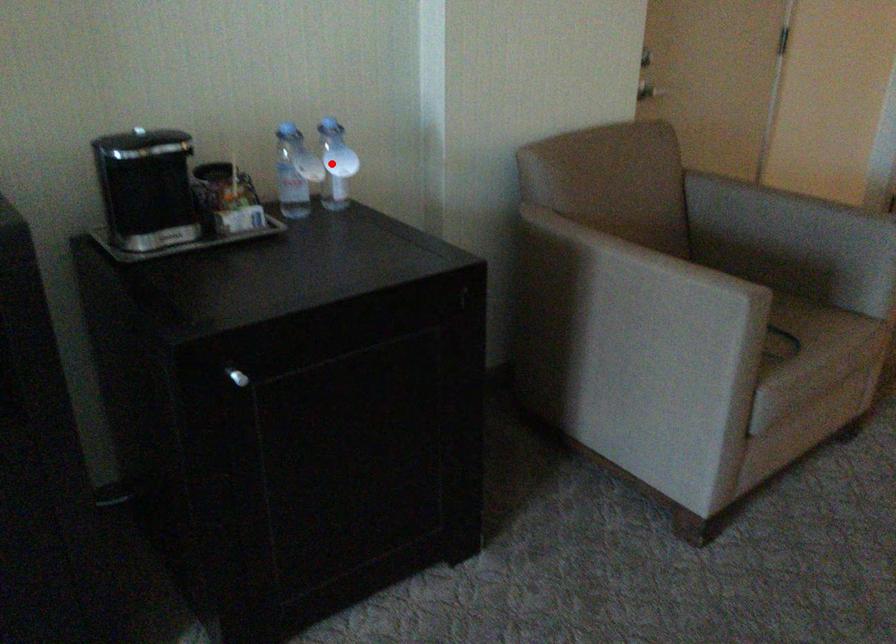
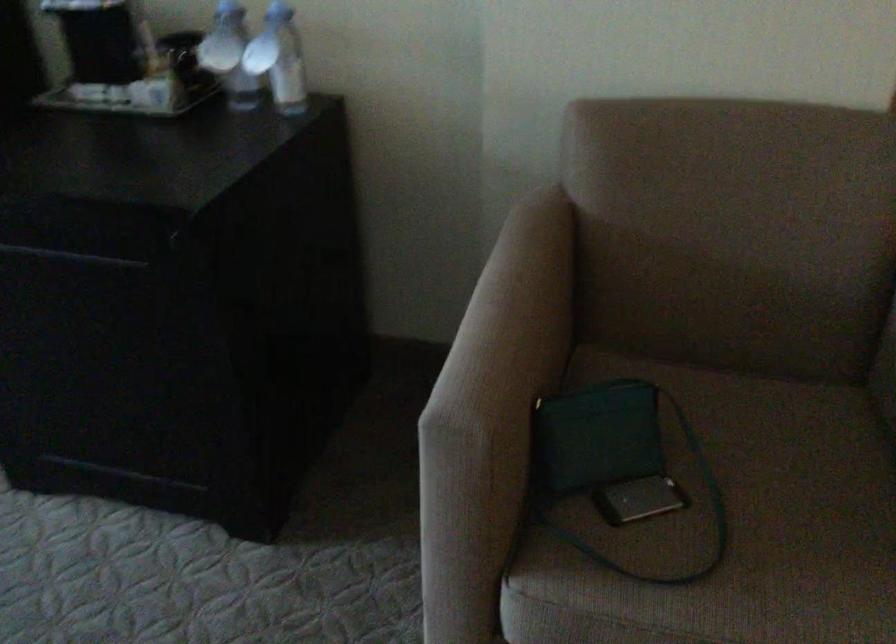
Question: I am providing you with two images of the same scene from different viewpoints. A red point is shown in image1. For the corresponding object point in image2, is it positioned nearer or farther from the camera?

Choices:
 (A) Nearer
 (B) Farther

Answer: (A)